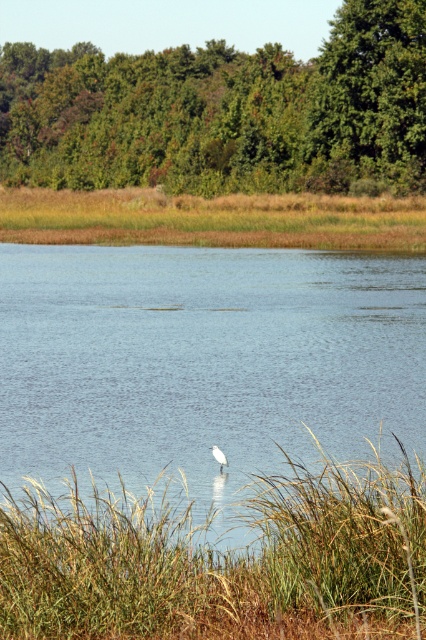
You are an environmental scientist assessing the habitat of the white matte bird at center. Based on the scene, can you determine if the clear water at center provides enough space for the bird to move freely?

The clear water at center has a larger width than the white matte bird at center, so there is sufficient space for the bird to move freely.